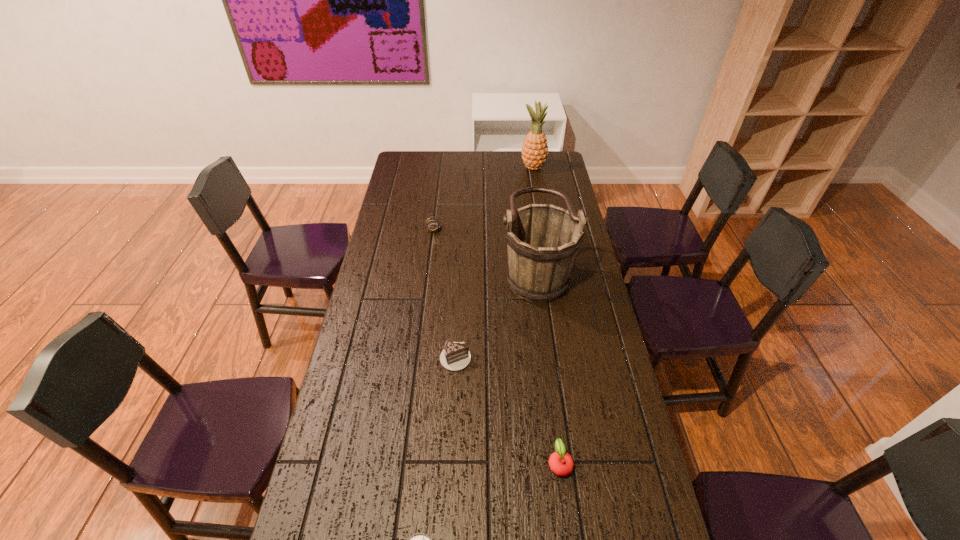
I want to click on vacant space that satisfies the following two spatial constraints: 1. on the face of the fifth farthest object; 2. on the left side of the second farthest object, so click(405, 463).

The width and height of the screenshot is (960, 540). I want to click on vacant area that satisfies the following two spatial constraints: 1. on the face of the fifth nearest object; 2. on the left side of the chocolate cake, so click(418, 357).

In order to click on vacant region that satisfies the following two spatial constraints: 1. on the handle side of the bucket; 2. on the front side of the chocolate cake in this screenshot , I will do `click(547, 357)`.

This screenshot has height=540, width=960. I want to click on free space that satisfies the following two spatial constraints: 1. on the face of the fourth shortest object; 2. on the right side of the second nearest object, so click(405, 463).